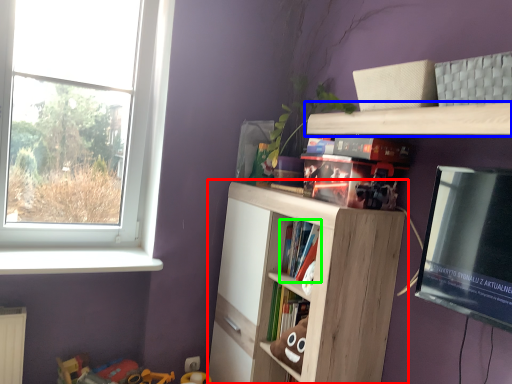
Question: Which is nearer to the shelf (highlighted by a red box)? shelf (highlighted by a blue box) or book (highlighted by a green box).

Choices:
 (A) shelf
 (B) book

Answer: (B)